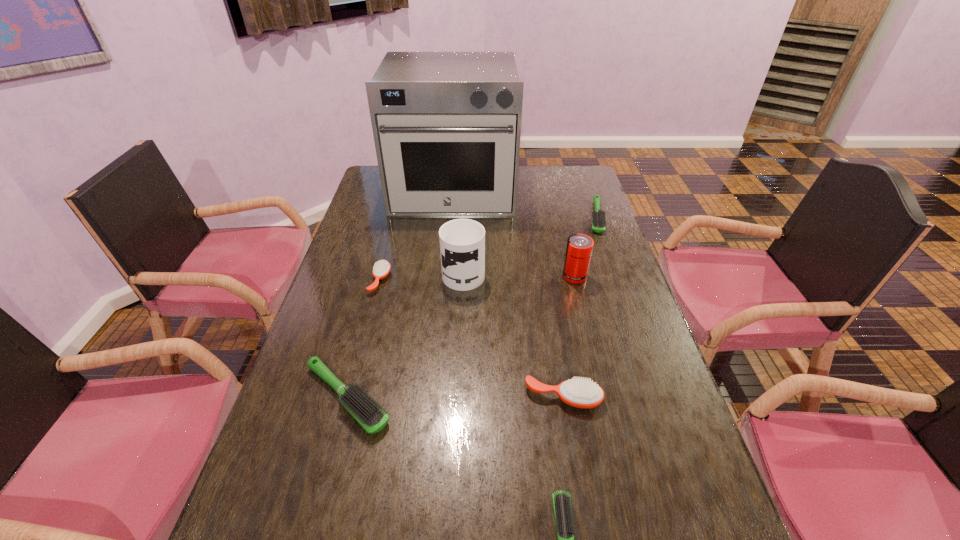
Identify the location of free space located on the front of the fourth nearest hairbrush. The height and width of the screenshot is (540, 960). (x=348, y=407).

The width and height of the screenshot is (960, 540). Identify the location of object at the far edge. (447, 125).

The height and width of the screenshot is (540, 960). Identify the location of toaster oven that is at the left edge. (447, 125).

Find the location of a particular element. can that is at the right edge is located at coordinates (579, 248).

In order to click on hairbrush that is at the right edge in this screenshot , I will do `click(598, 216)`.

This screenshot has height=540, width=960. What are the coordinates of `object at the far left corner` in the screenshot? It's located at (447, 125).

The image size is (960, 540). What are the coordinates of `vacant area at the left edge` in the screenshot? It's located at (296, 406).

In the image, there is a desktop. Identify the location of free space at the right edge. Image resolution: width=960 pixels, height=540 pixels. (588, 282).

The height and width of the screenshot is (540, 960). In the image, there is a desktop. What are the coordinates of `vacant space at the far right corner` in the screenshot? It's located at point(570,171).

The width and height of the screenshot is (960, 540). In order to click on vacant space in between the smaller orange hairbrush and the toaster oven in this screenshot , I will do coord(417,235).